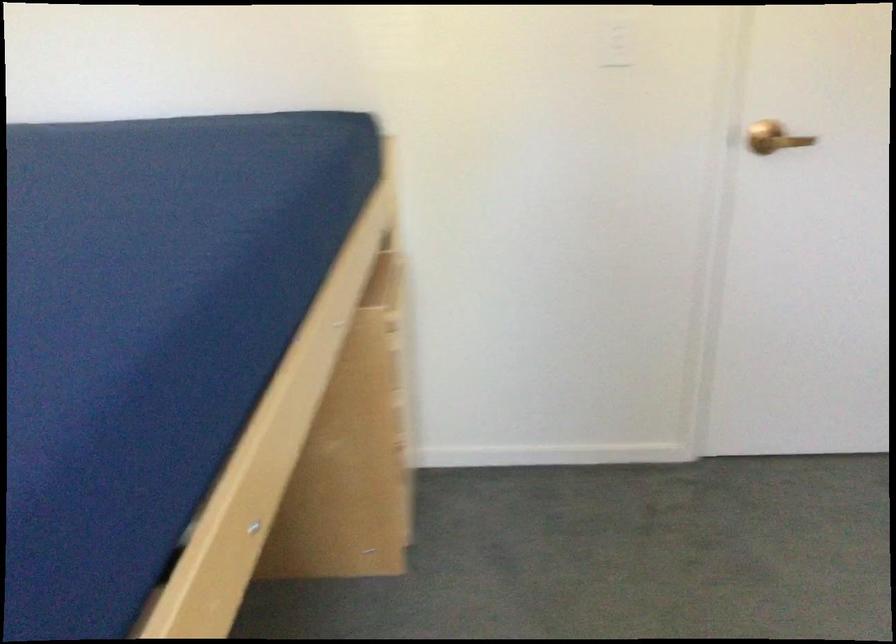
Find where to pull the brass door handle. Please return your answer as a coordinate pair (x, y).

(773, 138)